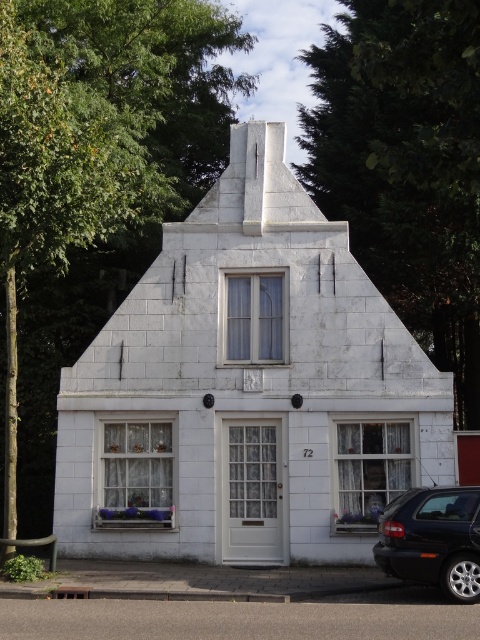
Does green leafy tree at upper right have a greater height compared to shiny black car at lower right?

Yes, green leafy tree at upper right is taller than shiny black car at lower right.

Does green leafy tree at upper right have a lesser width compared to shiny black car at lower right?

No.

Which is behind, point (412, 259) or point (478, 593)?

Point (412, 259)

I want to click on green leafy tree at upper right, so click(x=406, y=164).

Between point (217, 81) and point (444, 33), which one is positioned in front?

Point (444, 33) is more forward.

Is green leafy tree at upper left bigger than green leafy tree at upper right?

Incorrect, green leafy tree at upper left is not larger than green leafy tree at upper right.

The width and height of the screenshot is (480, 640). I want to click on green leafy tree at upper left, so click(92, 186).

Who is higher up, green leafy tree at upper left or shiny black car at lower right?

green leafy tree at upper left

At what (x,y) coordinates should I click in order to perform the action: click on green leafy tree at upper left. Please return your answer as a coordinate pair (x, y). Image resolution: width=480 pixels, height=640 pixels. Looking at the image, I should click on (92, 186).

Identify the location of green leafy tree at upper left. (92, 186).